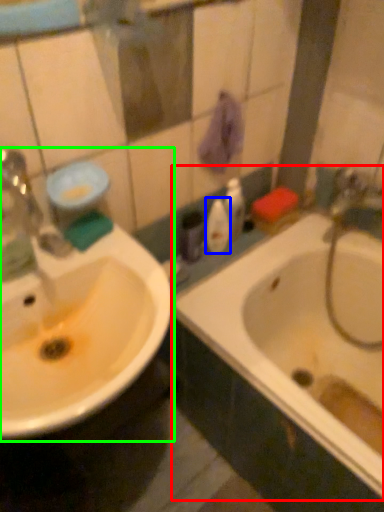
Question: Based on their relative distances, which object is nearer to bathtub (highlighted by a red box)? Choose from mouthwash (highlighted by a blue box) and sink (highlighted by a green box).

Choices:
 (A) mouthwash
 (B) sink

Answer: (A)